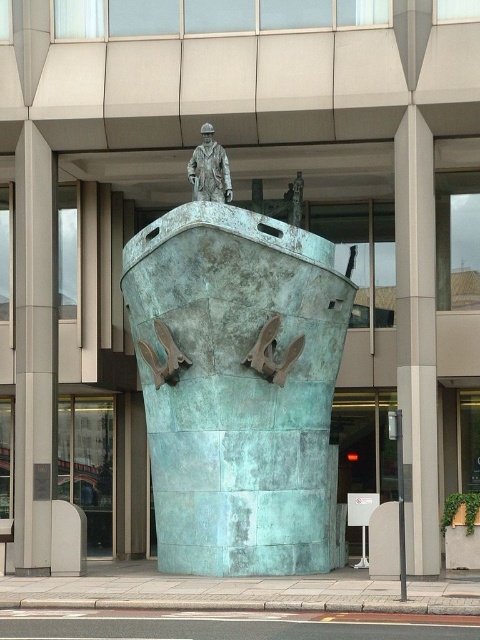
Is point (416, 157) positioned before point (156, 387)?

Yes, point (416, 157) is in front of point (156, 387).

Is smooth gray pillar at center right below green patina anchor at lower center?

No.

Between point (408, 202) and point (156, 387), which one is positioned behind?

The point (156, 387) is behind.

Where is `smooth gray pillar at center right`? Image resolution: width=480 pixels, height=640 pixels. smooth gray pillar at center right is located at coordinates (417, 337).

From the picture: Is green patina ship at center bigger than green patina anchor at center?

No.

Which is in front, point (171, 332) or point (259, 371)?

Positioned in front is point (259, 371).

Find the location of a particular element. The image size is (480, 640). green patina ship at center is located at coordinates (239, 387).

This screenshot has width=480, height=640. I want to click on matte gray pillar at left, so click(x=34, y=349).

Can you confirm if matte gray pillar at left is thinner than green patina anchor at center?

No.

The height and width of the screenshot is (640, 480). What are the coordinates of `matte gray pillar at left` in the screenshot? It's located at (34, 349).